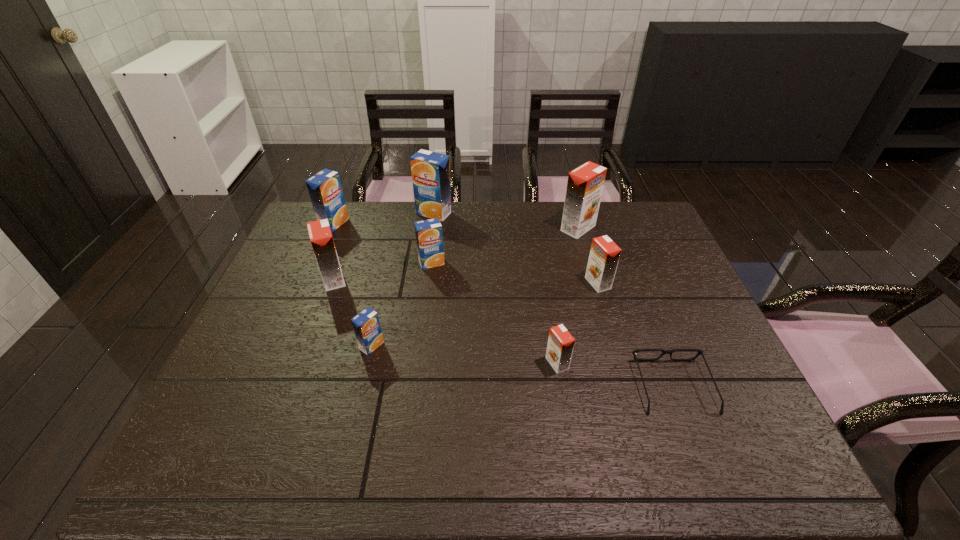
The height and width of the screenshot is (540, 960). What are the coordinates of `the shortest object` in the screenshot? It's located at (663, 351).

You are a GUI agent. You are given a task and a screenshot of the screen. Output one action in this format:
    pyautogui.click(x=<x>, y=<y>)
    Task: Click on the vacant space located 0.280m on the left of the farthest orange orange juice
    The image size is (960, 540).
    Given the screenshot: What is the action you would take?
    pyautogui.click(x=476, y=228)

I want to click on free region located 0.080m on the front of the biggest blue orange_juice, so click(431, 236).

Identify the location of free space located 0.120m on the front of the leftmost blue orange_juice. The height and width of the screenshot is (540, 960). (321, 255).

Locate an element on the screen. Image resolution: width=960 pixels, height=540 pixels. vacant space situated on the front of the leftmost orange orange juice is located at coordinates (316, 329).

At what (x,y) coordinates should I click in order to perform the action: click on vacant space located on the front of the second nearest blue orange_juice. Please return your answer as a coordinate pair (x, y). This screenshot has height=540, width=960. Looking at the image, I should click on (428, 293).

Locate an element on the screen. Image resolution: width=960 pixels, height=540 pixels. vacant area situated on the left of the third biggest orange orange juice is located at coordinates (520, 284).

Where is `vacant area situated 0.210m on the right of the third object from left to right`? vacant area situated 0.210m on the right of the third object from left to right is located at coordinates click(x=467, y=346).

Where is `vacant space located 0.160m on the left of the nearest orange orange juice`? vacant space located 0.160m on the left of the nearest orange orange juice is located at coordinates (480, 363).

Identify the location of free space located on the front-facing side of the spectacles. (636, 287).